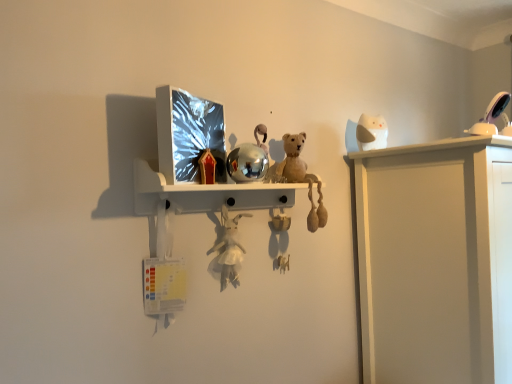
The height and width of the screenshot is (384, 512). Describe the element at coordinates (229, 249) in the screenshot. I see `white plush toy at center, acting as the third toy starting from the back` at that location.

The width and height of the screenshot is (512, 384). Describe the element at coordinates (490, 116) in the screenshot. I see `white glossy lamp at upper right, which is counted as the third toy, starting from the bottom` at that location.

Where is `white plush toy at center, placed as the third toy when sorted from right to left`? white plush toy at center, placed as the third toy when sorted from right to left is located at coordinates (229, 249).

Is white matte owl at upper right, marked as the 2th toy in a top-to-bottom arrangement, bigger than white glossy lamp at upper right, which is the second toy from back to front?

Correct, white matte owl at upper right, marked as the 2th toy in a top-to-bottom arrangement, is larger in size than white glossy lamp at upper right, which is the second toy from back to front.

Would you say white matte owl at upper right, which ranks as the first toy in back-to-front order, contains white glossy lamp at upper right, positioned as the first toy in right-to-left order?

Definitely not — white glossy lamp at upper right, positioned as the first toy in right-to-left order, is not inside white matte owl at upper right, which ranks as the first toy in back-to-front order.

Where is `toy that is above the white glossy lamp at upper right, which is counted as the third toy, starting from the bottom (from a real-world perspective)`? Image resolution: width=512 pixels, height=384 pixels. toy that is above the white glossy lamp at upper right, which is counted as the third toy, starting from the bottom (from a real-world perspective) is located at coordinates (371, 133).

From a real-world perspective, which object stands above the other?

white matte owl at upper right, marked as the 2th toy in a top-to-bottom arrangement, is physically above.

Who is taller, white matte owl at upper right, which is counted as the 2th toy, starting from the right, or white plush toy at center, placed as the third toy when sorted from right to left?

Standing taller between the two is white plush toy at center, placed as the third toy when sorted from right to left.

From the image's perspective, is white matte owl at upper right, which is counted as the 2th toy, starting from the right, over white plush toy at center, positioned as the 1th toy in front-to-back order?

Yes, from the image's perspective, white matte owl at upper right, which is counted as the 2th toy, starting from the right, is over white plush toy at center, positioned as the 1th toy in front-to-back order.

In terms of width, does white plush toy at center, positioned as the 1th toy in front-to-back order, look wider or thinner when compared to white glossy lamp at upper right, the 3th toy viewed from the left?

In the image, white plush toy at center, positioned as the 1th toy in front-to-back order, appears to be more narrow than white glossy lamp at upper right, the 3th toy viewed from the left.

From the image's perspective, is white plush toy at center, which is the first toy from bottom to top, under white glossy lamp at upper right, which is the first toy in top-to-bottom order?

Indeed, from the image's perspective, white plush toy at center, which is the first toy from bottom to top, is shown beneath white glossy lamp at upper right, which is the first toy in top-to-bottom order.

Is white plush toy at center, which is the first toy from bottom to top, at the right side of white glossy lamp at upper right, the 3th toy viewed from the left?

Incorrect, white plush toy at center, which is the first toy from bottom to top, is not on the right side of white glossy lamp at upper right, the 3th toy viewed from the left.

Which of these two, white plush toy at center, marked as the 1th toy in a left-to-right arrangement, or white glossy lamp at upper right, which is counted as the third toy, starting from the bottom, is smaller?

white glossy lamp at upper right, which is counted as the third toy, starting from the bottom.

From a real-world perspective, which object rests below the other?

white plush toy at center, placed as the third toy when sorted from right to left, from a real-world perspective.

Does white plush toy at center, placed as the third toy when sorted from right to left, have a larger size compared to white matte owl at upper right, which is counted as the 2th toy, starting from the right?

Yes.

Locate an element on the screen. the 2nd toy located beneath the white matte owl at upper right, placed as the 2th toy when sorted from bottom to top (from a real-world perspective) is located at coordinates (229, 249).

Which of these two, white plush toy at center, which is the first toy from bottom to top, or white matte owl at upper right, placed as the 2th toy when sorted from bottom to top, stands taller?

With more height is white plush toy at center, which is the first toy from bottom to top.

Is white glossy lamp at upper right, the 3th toy viewed from the left, taller than white matte owl at upper right, which is counted as the 2th toy, starting from the right?

No, white glossy lamp at upper right, the 3th toy viewed from the left, is not taller than white matte owl at upper right, which is counted as the 2th toy, starting from the right.

Considering the positions of objects white glossy lamp at upper right, which is counted as the third toy, starting from the bottom, and white matte owl at upper right, placed as the 2th toy when sorted from bottom to top, in the image provided, who is behind, white glossy lamp at upper right, which is counted as the third toy, starting from the bottom, or white matte owl at upper right, placed as the 2th toy when sorted from bottom to top,?

white matte owl at upper right, placed as the 2th toy when sorted from bottom to top, is behind.

From the picture: Can you confirm if white glossy lamp at upper right, acting as the 2th toy starting from the front, is thinner than white matte owl at upper right, which is counted as the 2th toy, starting from the right?

Incorrect, the width of white glossy lamp at upper right, acting as the 2th toy starting from the front, is not less than that of white matte owl at upper right, which is counted as the 2th toy, starting from the right.

From the image's perspective, would you say white glossy lamp at upper right, acting as the 2th toy starting from the front, is positioned over white plush toy at center, placed as the third toy when sorted from right to left?

Yes, from the image's perspective, white glossy lamp at upper right, acting as the 2th toy starting from the front, is on top of white plush toy at center, placed as the third toy when sorted from right to left.

At what (x,y) coordinates should I click in order to perform the action: click on toy that is in front of the white glossy lamp at upper right, the 3th toy viewed from the left. Please return your answer as a coordinate pair (x, y). Looking at the image, I should click on (229, 249).

How far apart are white glossy lamp at upper right, which is the second toy from back to front, and white plush toy at center, the third toy viewed from the top?

white glossy lamp at upper right, which is the second toy from back to front, is 34.07 inches from white plush toy at center, the third toy viewed from the top.

From a real-world perspective, relative to white plush toy at center, placed as the third toy when sorted from right to left, is white glossy lamp at upper right, the 3th toy viewed from the left, vertically above or below?

From a real-world perspective, white glossy lamp at upper right, the 3th toy viewed from the left, is physically above white plush toy at center, placed as the third toy when sorted from right to left.

You are a GUI agent. You are given a task and a screenshot of the screen. Output one action in this format:
    pyautogui.click(x=<x>, y=<y>)
    Task: Click on the 1st toy counting from the left side of the white glossy lamp at upper right, which is the first toy in top-to-bottom order
    This screenshot has height=384, width=512.
    Given the screenshot: What is the action you would take?
    pyautogui.click(x=371, y=133)

From the image's perspective, starting from the white plush toy at center, positioned as the 1th toy in front-to-back order, which toy is the 1st one above? Please provide its 2D coordinates.

[(371, 133)]

Based on the photo, from the image, which object appears to be farther from white plush toy at center, the third toy viewed from the top, white matte owl at upper right, which is counted as the 2th toy, starting from the right, or white glossy lamp at upper right, positioned as the first toy in right-to-left order?

white glossy lamp at upper right, positioned as the first toy in right-to-left order, is further to white plush toy at center, the third toy viewed from the top.

Looking at this image, from the image, which object appears to be farther from white glossy lamp at upper right, the 3th toy viewed from the left, white matte owl at upper right, placed as the 2th toy when sorted from bottom to top, or white plush toy at center, placed as the third toy when sorted from right to left?

Based on the image, white plush toy at center, placed as the third toy when sorted from right to left, appears to be further to white glossy lamp at upper right, the 3th toy viewed from the left.

From the image, which object appears to be nearer to white matte owl at upper right, marked as the 2th toy in a top-to-bottom arrangement, white glossy lamp at upper right, which is the second toy from back to front, or white plush toy at center, marked as the 1th toy in a left-to-right arrangement?

Among the two, white glossy lamp at upper right, which is the second toy from back to front, is located nearer to white matte owl at upper right, marked as the 2th toy in a top-to-bottom arrangement.

Estimate the real-world distances between objects in this image. Which object is closer to white matte owl at upper right, placed as the 2th toy when sorted from bottom to top, white plush toy at center, which is the first toy from bottom to top, or white glossy lamp at upper right, positioned as the first toy in right-to-left order?

white glossy lamp at upper right, positioned as the first toy in right-to-left order.

When comparing their distances from white glossy lamp at upper right, acting as the 2th toy starting from the front, does white plush toy at center, positioned as the 1th toy in front-to-back order, or white matte owl at upper right, which appears as the second toy when viewed from the left, seem closer?

white matte owl at upper right, which appears as the second toy when viewed from the left.

Which object lies nearer to the anchor point white plush toy at center, positioned as the 1th toy in front-to-back order, white glossy lamp at upper right, which is the first toy in top-to-bottom order, or white matte owl at upper right, which ranks as the first toy in back-to-front order?

white matte owl at upper right, which ranks as the first toy in back-to-front order, is closer to white plush toy at center, positioned as the 1th toy in front-to-back order.

You are a GUI agent. You are given a task and a screenshot of the screen. Output one action in this format:
    pyautogui.click(x=<x>, y=<y>)
    Task: Click on the toy between white plush toy at center, positioned as the 1th toy in front-to-back order, and white glossy lamp at upper right, the 3th toy viewed from the left, from left to right
    This screenshot has width=512, height=384.
    Given the screenshot: What is the action you would take?
    pyautogui.click(x=371, y=133)